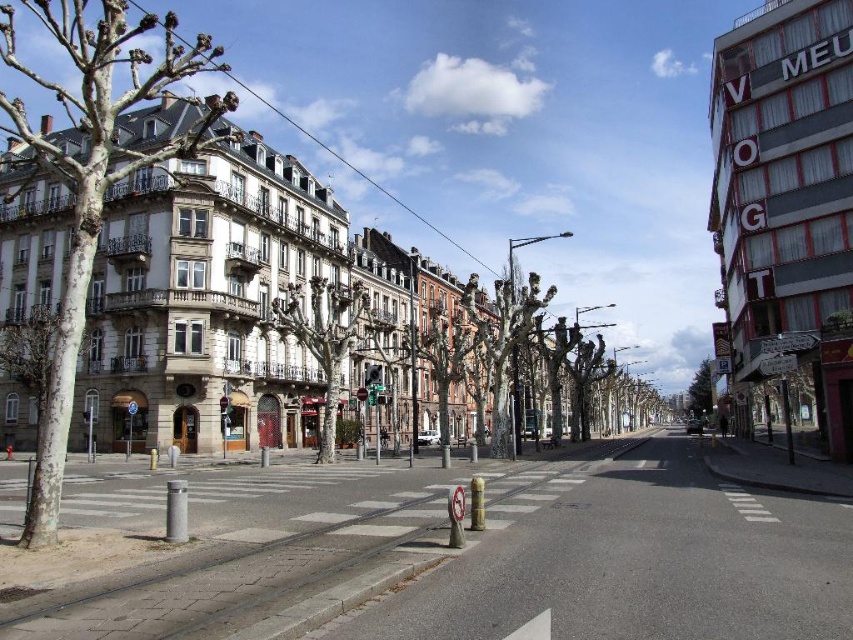
Question: Which of these objects is positioned farthest from the bare bark tree at center?

Choices:
 (A) bare wood tree at center
 (B) smooth bark tree at left
 (C) smooth brown tree at center
 (D) green leafy tree at center

Answer: (D)

Question: From the image, what is the correct spatial relationship of smooth bark tree at left in relation to smooth brown tree at center?

Choices:
 (A) right
 (B) left

Answer: (B)

Question: Which object appears closest to the camera in this image?

Choices:
 (A) smooth brown tree at center
 (B) green leafy tree at center
 (C) smooth bark tree at left
 (D) bare bark tree at center

Answer: (C)

Question: Estimate the real-world distances between objects in this image. Which object is closer to the bare wood tree at center?

Choices:
 (A) green leafy tree at center
 (B) smooth bark tree at left
 (C) bare bark tree at center

Answer: (C)

Question: Does bare wood tree at center appear on the right side of bare bark tree at center?

Choices:
 (A) no
 (B) yes

Answer: (A)

Question: In this image, where is smooth bark tree at left located relative to smooth brown tree at center?

Choices:
 (A) left
 (B) right

Answer: (A)